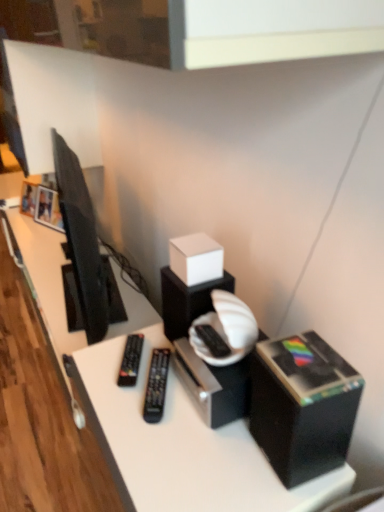
Question: In the image, is black plastic remote at center, arranged as the 2th equipment when viewed from the right, positioned in front of or behind black plastic remote at center, acting as the 2th equipment starting from the left?

Choices:
 (A) front
 (B) behind

Answer: (B)

Question: Does point (119, 372) appear closer or farther from the camera than point (155, 367)?

Choices:
 (A) closer
 (B) farther

Answer: (A)

Question: Which is farther from the black plastic remote at center, positioned as the first equipment in right-to-left order?

Choices:
 (A) black plastic box at lower right, marked as the 2th box in a top-to-bottom arrangement
 (B) white matte cube at center, marked as the 2th box in a bottom-to-top arrangement
 (C) matte black television at left
 (D) black plastic remote at center, which is counted as the first equipment, starting from the left

Answer: (C)

Question: Which object is the farthest from the white matte cube at center, positioned as the 1th box in top-to-bottom order?

Choices:
 (A) matte black television at left
 (B) black plastic box at lower right, the 2th box positioned from the back
 (C) black plastic remote at center, acting as the 2th equipment starting from the left
 (D) black plastic remote at center, which is counted as the first equipment, starting from the left

Answer: (A)